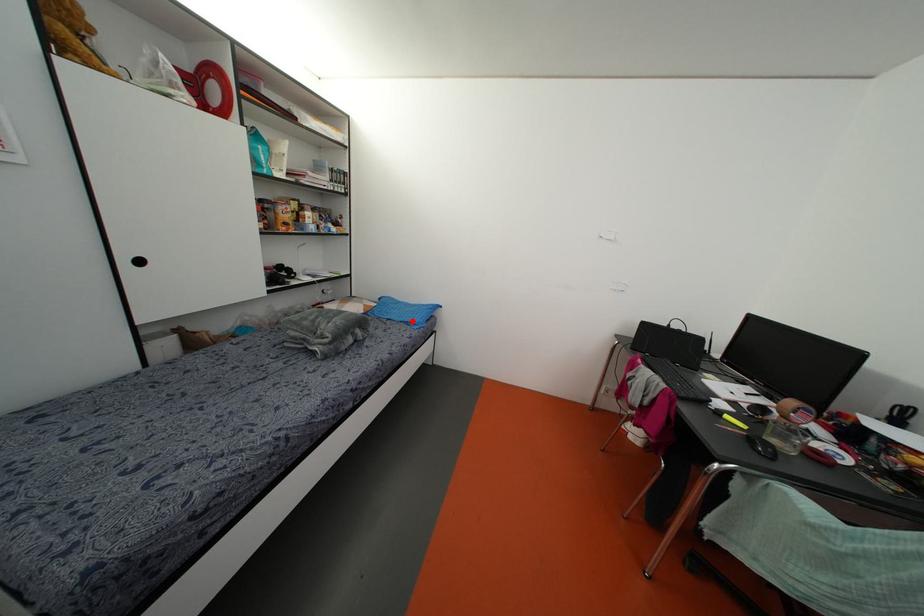
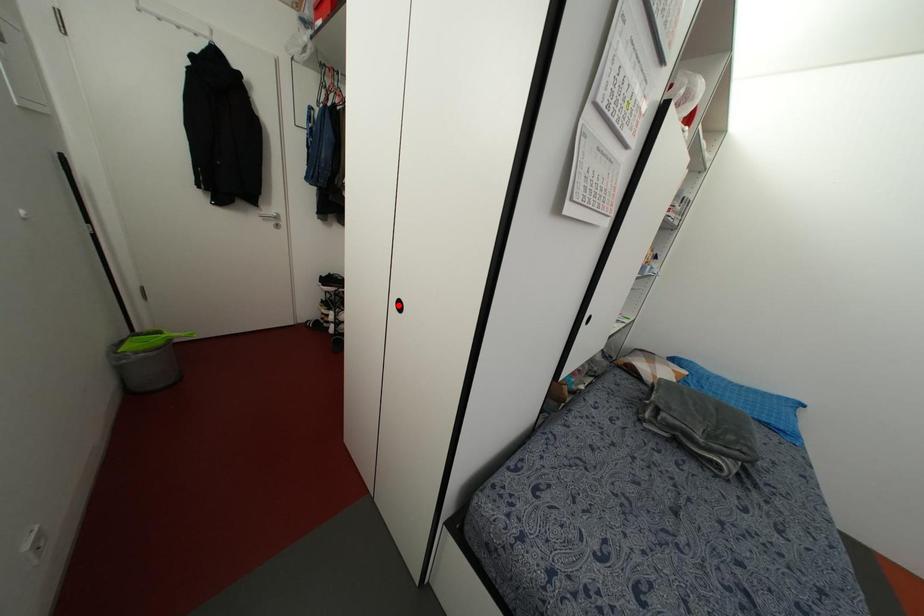
I am providing you with two images of the same scene from different viewpoints. A red point is marked on the first image and another point is marked on the second image. Does the point marked in image1 correspond to the same location as the one in image2?

No